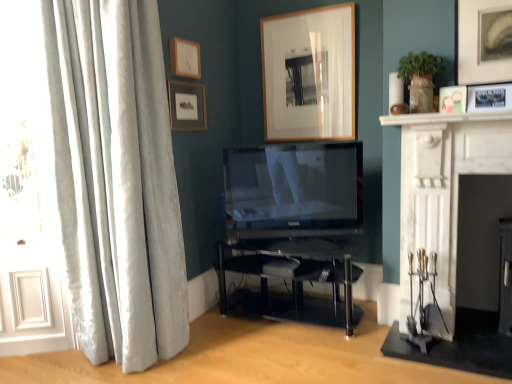
This screenshot has height=384, width=512. Describe the element at coordinates (293, 279) in the screenshot. I see `transparent glass tv stand at center` at that location.

The image size is (512, 384). Identify the location of matte black tv at center. (294, 190).

Image resolution: width=512 pixels, height=384 pixels. Identify the location of matte wood picture frame at upper center, the 2th picture frame viewed from the left. (184, 58).

This screenshot has height=384, width=512. I want to click on silky white curtains at left, so click(116, 180).

Looking at this image, is white marble fireplace at right at the back of matte gray picture frame at upper right, marked as the second picture frame in a right-to-left arrangement?

No, matte gray picture frame at upper right, marked as the second picture frame in a right-to-left arrangement, is not facing the opposite direction of white marble fireplace at right.

Is matte gray picture frame at upper right, marked as the second picture frame in a right-to-left arrangement, bigger or smaller than white marble fireplace at right?

Clearly, matte gray picture frame at upper right, marked as the second picture frame in a right-to-left arrangement, is smaller in size than white marble fireplace at right.

Can you confirm if matte gray picture frame at upper right, the 4th picture frame positioned from the left, is shorter than white marble fireplace at right?

Yes.

Choose the correct answer: Is transparent glass tv stand at center inside white marble fireplace at upper right or outside it?

transparent glass tv stand at center is not enclosed by white marble fireplace at upper right.

Can you confirm if transparent glass tv stand at center is shorter than white marble fireplace at upper right?

Incorrect, the height of transparent glass tv stand at center does not fall short of that of white marble fireplace at upper right.

From a real-world perspective, is transparent glass tv stand at center above or below white marble fireplace at upper right?

In terms of real-world spatial position, transparent glass tv stand at center is below white marble fireplace at upper right.

Which is in front, transparent glass tv stand at center or white marble fireplace at upper right?

white marble fireplace at upper right.

Does point (170, 85) come closer to viewer compared to point (337, 29)?

Yes, it is in front of point (337, 29).

In terms of width, does matte wooden picture frame at upper left, which is counted as the first picture frame, starting from the left, look wider or thinner when compared to wooden picture frame at upper center, which appears as the 3th picture frame when viewed from the right?

Considering their sizes, matte wooden picture frame at upper left, which is counted as the first picture frame, starting from the left, looks slimmer than wooden picture frame at upper center, which appears as the 3th picture frame when viewed from the right.

Who is shorter, matte wooden picture frame at upper left, which is counted as the first picture frame, starting from the left, or wooden picture frame at upper center, which ranks as the third picture frame in left-to-right order?

Standing shorter between the two is matte wooden picture frame at upper left, which is counted as the first picture frame, starting from the left.

From a real-world perspective, is transparent glass tv stand at center physically below white marble fireplace at right?

Yes, from a real-world perspective, transparent glass tv stand at center is under white marble fireplace at right.

Is transparent glass tv stand at center at the left side of white marble fireplace at right?

Correct, you'll find transparent glass tv stand at center to the left of white marble fireplace at right.

In the image, is transparent glass tv stand at center positioned in front of or behind white marble fireplace at right?

Visually, transparent glass tv stand at center is located behind white marble fireplace at right.

From the image's perspective, between white marble fireplace at upper right and silky white curtains at left, which one is located above?

white marble fireplace at upper right appears higher in the image.

Between white marble fireplace at upper right and silky white curtains at left, which one appears on the right side from the viewer's perspective?

white marble fireplace at upper right.

Is the position of white marble fireplace at upper right more distant than that of silky white curtains at left?

Yes, the depth of white marble fireplace at upper right is greater than that of silky white curtains at left.

Is white marble fireplace at upper right far away from silky white curtains at left?

Absolutely, white marble fireplace at upper right is distant from silky white curtains at left.

Is point (500, 85) in front of point (460, 262)?

Yes.

Looking at their sizes, would you say matte white picture frame at upper right, which ranks as the 5th picture frame in left-to-right order, is wider or thinner than white marble fireplace at right?

Considering their sizes, matte white picture frame at upper right, which ranks as the 5th picture frame in left-to-right order, looks slimmer than white marble fireplace at right.

Between matte white picture frame at upper right, which ranks as the 1th picture frame in right-to-left order, and white marble fireplace at right, which one appears on the left side from the viewer's perspective?

From the viewer's perspective, white marble fireplace at right appears more on the left side.

In the image, is wooden picture frame at upper center, which appears as the 3th picture frame when viewed from the right, positioned in front of or behind matte white picture frame at upper right, which ranks as the 1th picture frame in right-to-left order?

In the image, wooden picture frame at upper center, which appears as the 3th picture frame when viewed from the right, appears behind matte white picture frame at upper right, which ranks as the 1th picture frame in right-to-left order.

At what (x,y) coordinates should I click in order to perform the action: click on the 2nd picture frame to the right when counting from the wooden picture frame at upper center, which appears as the 3th picture frame when viewed from the right. Please return your answer as a coordinate pair (x, y). The height and width of the screenshot is (384, 512). Looking at the image, I should click on (489, 97).

Does wooden picture frame at upper center, which ranks as the third picture frame in left-to-right order, have a larger size compared to matte white picture frame at upper right, which ranks as the 5th picture frame in left-to-right order?

Indeed, wooden picture frame at upper center, which ranks as the third picture frame in left-to-right order, has a larger size compared to matte white picture frame at upper right, which ranks as the 5th picture frame in left-to-right order.

From the image's perspective, does wooden picture frame at upper center, which ranks as the third picture frame in left-to-right order, appear higher than matte white picture frame at upper right, which ranks as the 5th picture frame in left-to-right order?

Correct, wooden picture frame at upper center, which ranks as the third picture frame in left-to-right order, appears higher than matte white picture frame at upper right, which ranks as the 5th picture frame in left-to-right order, in the image.

Identify the location of fireplace on the left of matte gray picture frame at upper right, marked as the second picture frame in a right-to-left arrangement. The image size is (512, 384). (455, 234).

Where is `mantle positioned vertically above the transparent glass tv stand at center (from a real-world perspective)`? The width and height of the screenshot is (512, 384). mantle positioned vertically above the transparent glass tv stand at center (from a real-world perspective) is located at coordinates (443, 118).

Based on their spatial positions, is transparent glass tv stand at center or wooden picture frame at upper center, which ranks as the third picture frame in left-to-right order, closer to matte white picture frame at upper right, which ranks as the 1th picture frame in right-to-left order?

wooden picture frame at upper center, which ranks as the third picture frame in left-to-right order, lies closer to matte white picture frame at upper right, which ranks as the 1th picture frame in right-to-left order, than the other object.

Based on their spatial positions, is white marble fireplace at upper right or matte wood picture frame at upper center, arranged as the 4th picture frame when viewed from the right, closer to white marble fireplace at right?

white marble fireplace at upper right is positioned closer to the anchor white marble fireplace at right.

Estimate the real-world distances between objects in this image. Which object is further from wooden picture frame at upper center, which appears as the 3th picture frame when viewed from the right, silky white curtains at left or white marble fireplace at upper right?

Based on the image, silky white curtains at left appears to be further to wooden picture frame at upper center, which appears as the 3th picture frame when viewed from the right.

Looking at the image, which one is located further to white marble fireplace at right, matte wooden picture frame at upper left, which is counted as the first picture frame, starting from the left, or matte wood picture frame at upper center, arranged as the 4th picture frame when viewed from the right?

The object further to white marble fireplace at right is matte wood picture frame at upper center, arranged as the 4th picture frame when viewed from the right.

From the image, which object appears to be farther from matte white picture frame at upper right, which ranks as the 1th picture frame in right-to-left order, white marble fireplace at upper right or white marble fireplace at right?

Among the two, white marble fireplace at right is located further to matte white picture frame at upper right, which ranks as the 1th picture frame in right-to-left order.

Looking at the image, which one is located further to matte wooden picture frame at upper left, arranged as the 5th picture frame when viewed from the right, silky white curtains at left or white marble fireplace at upper right?

Among the two, white marble fireplace at upper right is located further to matte wooden picture frame at upper left, arranged as the 5th picture frame when viewed from the right.

Estimate the real-world distances between objects in this image. Which object is closer to matte wooden picture frame at upper left, which is counted as the first picture frame, starting from the left, silky white curtains at left or matte gray picture frame at upper right, the 4th picture frame positioned from the left?

silky white curtains at left lies closer to matte wooden picture frame at upper left, which is counted as the first picture frame, starting from the left, than the other object.

Based on their spatial positions, is matte white picture frame at upper right, which ranks as the 1th picture frame in right-to-left order, or white marble fireplace at right closer to matte black tv at center?

white marble fireplace at right.

Identify the location of television between matte wood picture frame at upper center, arranged as the 4th picture frame when viewed from the right, and white marble fireplace at right. (294, 190).

Locate an element on the screen. This screenshot has height=384, width=512. fireplace between wooden picture frame at upper center, which appears as the 3th picture frame when viewed from the right, and transparent glass tv stand at center, in the vertical direction is located at coordinates (455, 234).

Identify the location of mantle located between matte black tv at center and matte white picture frame at upper right, which ranks as the 5th picture frame in left-to-right order, in the left-right direction. Image resolution: width=512 pixels, height=384 pixels. (443, 118).

Where is `mantle located between silky white curtains at left and matte white picture frame at upper right, which ranks as the 5th picture frame in left-to-right order, in the left-right direction`? The height and width of the screenshot is (384, 512). mantle located between silky white curtains at left and matte white picture frame at upper right, which ranks as the 5th picture frame in left-to-right order, in the left-right direction is located at coordinates (443, 118).